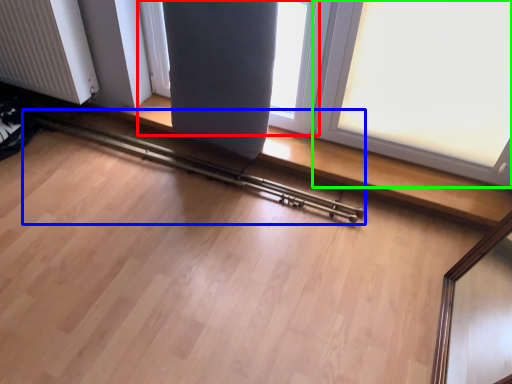
Question: Based on their relative distances, which object is farther from window (highlighted by a red box)? Choose from rail (highlighted by a blue box) and window (highlighted by a green box).

Choices:
 (A) rail
 (B) window

Answer: (A)